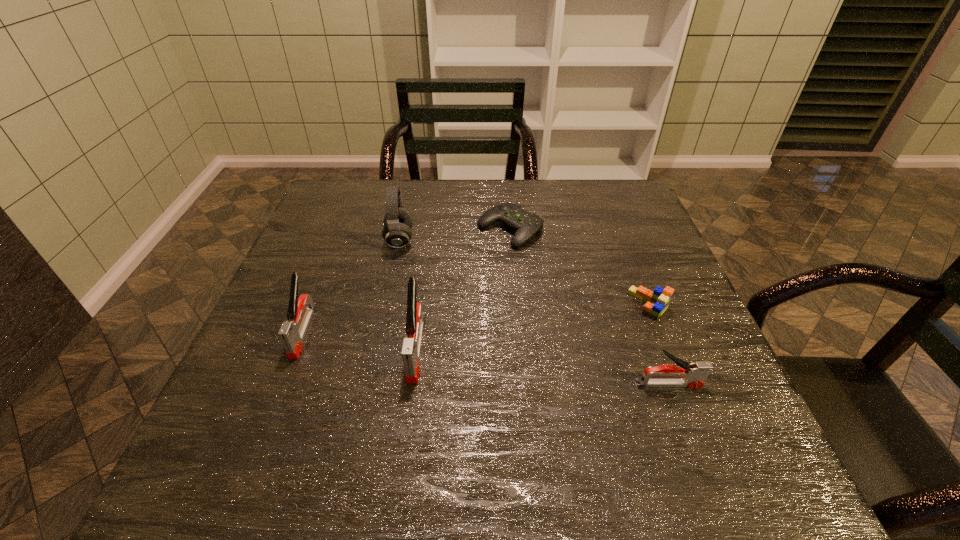
Where is `free space that satisfies the following two spatial constraints: 1. on the ear cups of the second shortest object; 2. on the left side of the fifth object from right to left`? This screenshot has width=960, height=540. free space that satisfies the following two spatial constraints: 1. on the ear cups of the second shortest object; 2. on the left side of the fifth object from right to left is located at coordinates (385, 304).

The width and height of the screenshot is (960, 540). I want to click on vacant position in the image that satisfies the following two spatial constraints: 1. on the back side of the second shortest object; 2. on the ear cups of the fifth object from right to left, so click(x=623, y=240).